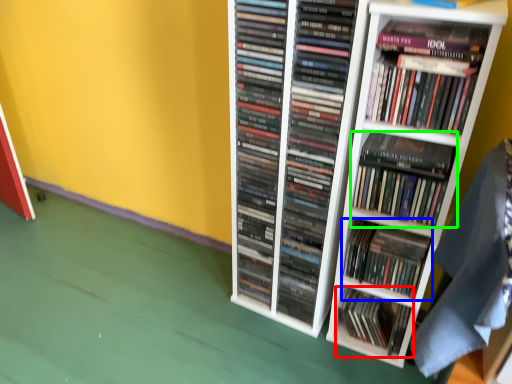
Question: Which object is positioned farthest from book (highlighted by a red box)? Select from book (highlighted by a blue box) and book (highlighted by a green box).

Choices:
 (A) book
 (B) book

Answer: (B)